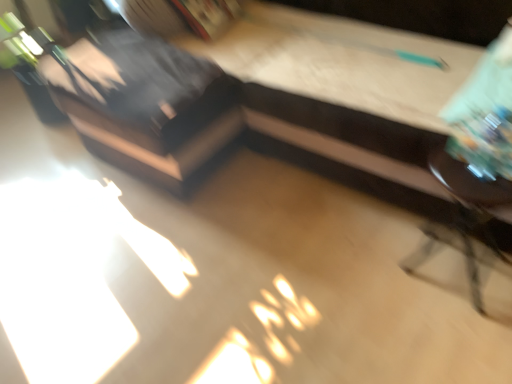
Identify the location of empty space that is ontop of metallic dark brown swivel chair at right (from a real-world perspective). This screenshot has height=384, width=512. (478, 172).